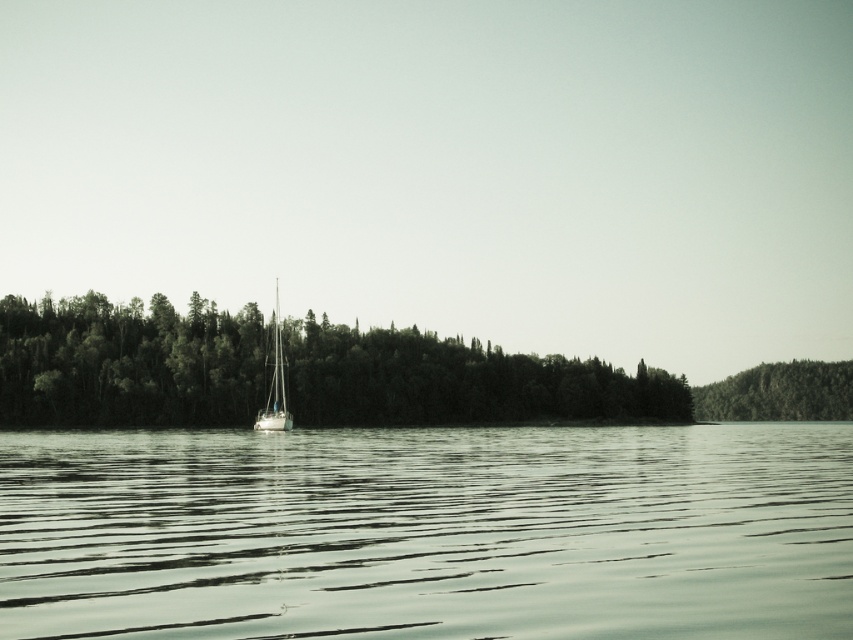
Question: Can you confirm if clear water at center is positioned to the left of green matte trees at center?

Choices:
 (A) yes
 (B) no

Answer: (B)

Question: Among these objects, which one is nearest to the camera?

Choices:
 (A) green matte trees at center
 (B) clear water at center
 (C) green textured forest at right
 (D) white glossy sailboat at center

Answer: (B)

Question: Which point is farther from the camera taking this photo?

Choices:
 (A) (271, 408)
 (B) (744, 400)
 (C) (490, 621)

Answer: (B)

Question: Does green matte trees at center have a larger size compared to green textured forest at right?

Choices:
 (A) yes
 (B) no

Answer: (A)

Question: Is clear water at center smaller than white glossy sailboat at center?

Choices:
 (A) yes
 (B) no

Answer: (A)

Question: Which of these objects is positioned farthest from the green textured forest at right?

Choices:
 (A) white glossy sailboat at center
 (B) green matte trees at center

Answer: (A)